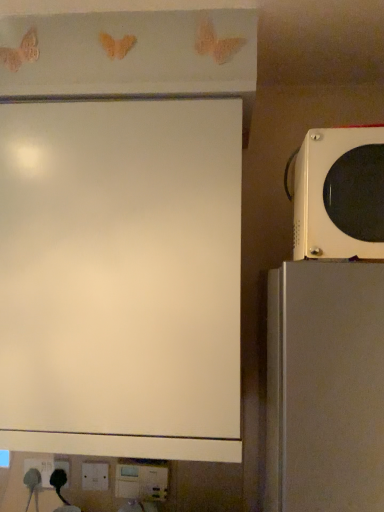
The image size is (384, 512). Find the location of `white glossy microwave at right`. white glossy microwave at right is located at coordinates (339, 195).

Is white matte board at upper left further to camera compared to white glossy microwave at right?

Yes, white matte board at upper left is further from the camera.

From the image's perspective, is white matte board at upper left under white glossy microwave at right?

Correct, white matte board at upper left appears lower than white glossy microwave at right in the image.

Considering the sizes of objects white matte board at upper left and white glossy microwave at right in the image provided, who is shorter, white matte board at upper left or white glossy microwave at right?

white glossy microwave at right.

Would you say white matte board at upper left is a long distance from white glossy microwave at right?

No.

Locate an element on the screen. The image size is (384, 512). microwave oven to the right of white matte board at upper left is located at coordinates (339, 195).

Based on their sizes in the image, would you say white glossy microwave at right is bigger or smaller than white matte board at upper left?

Clearly, white glossy microwave at right is smaller in size than white matte board at upper left.

From the picture: From a real-world perspective, which object stands above the other?

From a 3D spatial view, white glossy microwave at right is above.

Does white glossy microwave at right come behind white matte board at upper left?

No, white glossy microwave at right is in front of white matte board at upper left.

How distant is white glossy microwave at right from white plastic electric outlet at lower left?

1.11 meters.

Does white glossy microwave at right turn towards white plastic electric outlet at lower left?

No.

Is white glossy microwave at right further to camera compared to white plastic electric outlet at lower left?

That is False.

From a real-world perspective, is white glossy microwave at right positioned above or below white plastic electric outlet at lower left?

In terms of real-world spatial position, white glossy microwave at right is above white plastic electric outlet at lower left.

This screenshot has width=384, height=512. I want to click on electric outlet to the left of white matte board at upper left, so click(x=47, y=469).

Between white plastic electric outlet at lower left and white matte board at upper left, which one appears on the left side from the viewer's perspective?

white plastic electric outlet at lower left.

Between white plastic electric outlet at lower left and white matte board at upper left, which one is positioned in front?

white matte board at upper left is more forward.

Is white plastic electric outlet at lower left wider than white matte board at upper left?

Incorrect, the width of white plastic electric outlet at lower left does not surpass that of white matte board at upper left.

What are the coordinates of `microwave oven above the white plastic electric outlet at lower left (from the image's perspective)` in the screenshot? It's located at (339, 195).

In terms of size, does white plastic electric outlet at lower left appear bigger or smaller than white glossy microwave at right?

Clearly, white plastic electric outlet at lower left is smaller in size than white glossy microwave at right.

Looking at this image, which object is positioned more to the right, white plastic electric outlet at lower left or white glossy microwave at right?

From the viewer's perspective, white glossy microwave at right appears more on the right side.

Can you confirm if white plastic electric outlet at lower left is taller than white glossy microwave at right?

No.

Between point (191, 245) and point (45, 483), which one is positioned in front?

The point (191, 245) is closer.

Would you say white matte board at upper left is outside white plastic electric outlet at lower left?

Absolutely, white matte board at upper left is external to white plastic electric outlet at lower left.

Is white matte board at upper left not close to white plastic electric outlet at lower left?

white matte board at upper left is near white plastic electric outlet at lower left, not far away.

Locate an element on the screen. Image resolution: width=384 pixels, height=512 pixels. projection screen behind the white glossy microwave at right is located at coordinates (121, 278).

This screenshot has width=384, height=512. I want to click on microwave oven in front of the white matte board at upper left, so click(339, 195).

Which object lies nearer to the anchor point white glossy microwave at right, white plastic electric outlet at lower left or white matte board at upper left?

Based on the image, white matte board at upper left appears to be nearer to white glossy microwave at right.

Based on their spatial positions, is white glossy microwave at right or white plastic electric outlet at lower left further from white matte board at upper left?

white plastic electric outlet at lower left lies further to white matte board at upper left than the other object.

Based on their spatial positions, is white matte board at upper left or white glossy microwave at right further from white plastic electric outlet at lower left?

Among the two, white glossy microwave at right is located further to white plastic electric outlet at lower left.

From the picture: Estimate the real-world distances between objects in this image. Which object is further from white matte board at upper left, white plastic electric outlet at lower left or white glossy microwave at right?

white plastic electric outlet at lower left.

Looking at the image, which one is located further to white glossy microwave at right, white matte board at upper left or white plastic electric outlet at lower left?

The object further to white glossy microwave at right is white plastic electric outlet at lower left.

Considering their positions, is white glossy microwave at right positioned further to white plastic electric outlet at lower left than white matte board at upper left?

The object further to white plastic electric outlet at lower left is white glossy microwave at right.

The width and height of the screenshot is (384, 512). I want to click on projection screen between white glossy microwave at right and white plastic electric outlet at lower left vertically, so 121,278.